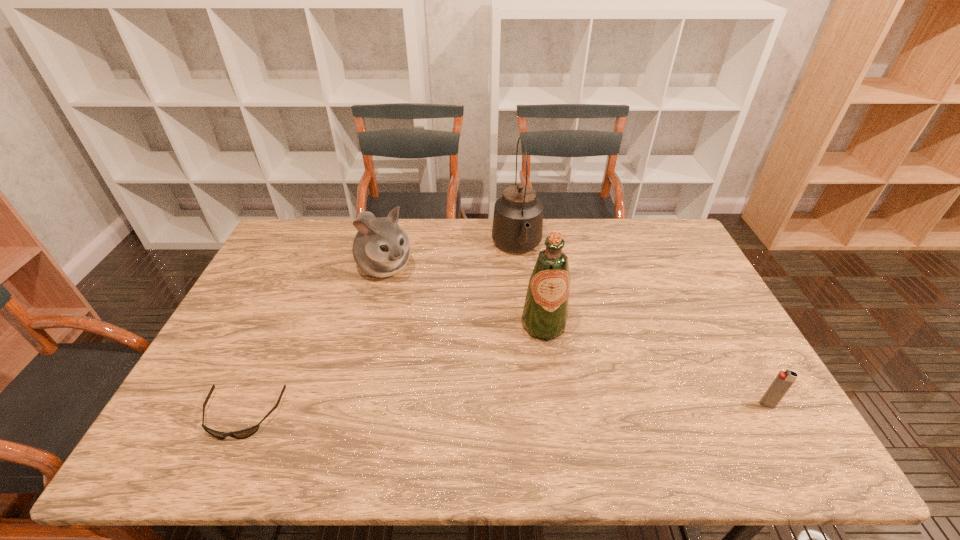
Identify the location of empty space between the rightmost object and the kettle. (642, 326).

The height and width of the screenshot is (540, 960). Find the location of `free space between the tallest object and the sunglasses`. free space between the tallest object and the sunglasses is located at coordinates (380, 331).

The image size is (960, 540). Find the location of `vacant area that lies between the third shortest object and the second tallest object`. vacant area that lies between the third shortest object and the second tallest object is located at coordinates (465, 296).

Where is `the third closest object to the third shortest object`? the third closest object to the third shortest object is located at coordinates (245, 433).

Locate which object is the third closest to the shortest object. Please provide its 2D coordinates. Your answer should be formatted as a tuple, i.e. [(x, y)], where the tuple contains the x and y coordinates of a point satisfying the conditions above.

[(517, 226)]

You are a GUI agent. You are given a task and a screenshot of the screen. Output one action in this format:
    pyautogui.click(x=<x>, y=<y>)
    Task: Click on the vacant region that satisfies the following two spatial constraints: 1. on the front side of the second tallest object; 2. on the left side of the fourth tallest object
    This screenshot has width=960, height=540.
    Given the screenshot: What is the action you would take?
    pyautogui.click(x=556, y=404)